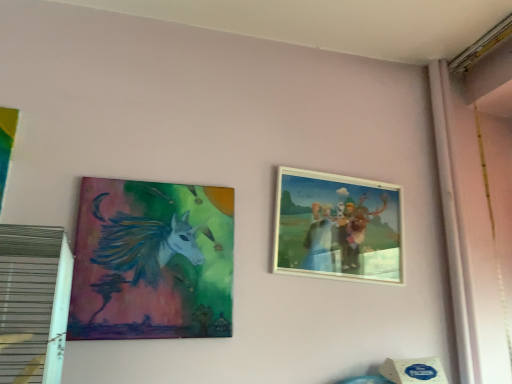
Question: Should I look upward or downward to see wooden picture frame at upper right, the first picture frame positioned from the right?

Choices:
 (A) up
 (B) down

Answer: (B)

Question: Is wooden picture frame at upper right, arranged as the second picture frame when viewed from the left, facing towards matte acrylic painting of unicorn at left, the 1th picture frame viewed from the left?

Choices:
 (A) yes
 (B) no

Answer: (B)

Question: From a real-world perspective, is wooden picture frame at upper right, arranged as the second picture frame when viewed from the left, positioned under matte acrylic painting of unicorn at left, the 1th picture frame viewed from the left, based on gravity?

Choices:
 (A) yes
 (B) no

Answer: (B)

Question: Can we say wooden picture frame at upper right, arranged as the second picture frame when viewed from the left, lies outside matte acrylic painting of unicorn at left, the 1th picture frame viewed from the left?

Choices:
 (A) yes
 (B) no

Answer: (A)

Question: Is wooden picture frame at upper right, the first picture frame positioned from the right, oriented away from matte acrylic painting of unicorn at left, the 1th picture frame viewed from the left?

Choices:
 (A) no
 (B) yes

Answer: (A)

Question: From a real-world perspective, does wooden picture frame at upper right, arranged as the second picture frame when viewed from the left, stand above matte acrylic painting of unicorn at left, which appears as the second picture frame when viewed from the right?

Choices:
 (A) no
 (B) yes

Answer: (B)

Question: Considering the relative positions of wooden picture frame at upper right, the first picture frame positioned from the right, and matte acrylic painting of unicorn at left, the 1th picture frame viewed from the left, in the image provided, is wooden picture frame at upper right, the first picture frame positioned from the right, behind matte acrylic painting of unicorn at left, the 1th picture frame viewed from the left,?

Choices:
 (A) no
 (B) yes

Answer: (B)

Question: Is matte acrylic painting of unicorn at left, which appears as the second picture frame when viewed from the right, positioned behind wooden picture frame at upper right, the first picture frame positioned from the right?

Choices:
 (A) no
 (B) yes

Answer: (A)

Question: From the image's perspective, does matte acrylic painting of unicorn at left, which appears as the second picture frame when viewed from the right, appear higher than wooden picture frame at upper right, the first picture frame positioned from the right?

Choices:
 (A) no
 (B) yes

Answer: (A)

Question: Does matte acrylic painting of unicorn at left, the 1th picture frame viewed from the left, have a smaller size compared to wooden picture frame at upper right, arranged as the second picture frame when viewed from the left?

Choices:
 (A) yes
 (B) no

Answer: (A)

Question: Is there a large distance between matte acrylic painting of unicorn at left, which appears as the second picture frame when viewed from the right, and wooden picture frame at upper right, the first picture frame positioned from the right?

Choices:
 (A) no
 (B) yes

Answer: (A)

Question: Is matte acrylic painting of unicorn at left, the 1th picture frame viewed from the left, bigger than wooden picture frame at upper right, arranged as the second picture frame when viewed from the left?

Choices:
 (A) yes
 (B) no

Answer: (B)

Question: Can you confirm if matte acrylic painting of unicorn at left, the 1th picture frame viewed from the left, is shorter than wooden picture frame at upper right, arranged as the second picture frame when viewed from the left?

Choices:
 (A) yes
 (B) no

Answer: (B)

Question: In terms of width, does wooden picture frame at upper right, arranged as the second picture frame when viewed from the left, look wider or thinner when compared to matte acrylic painting of unicorn at left, which appears as the second picture frame when viewed from the right?

Choices:
 (A) wide
 (B) thin

Answer: (A)